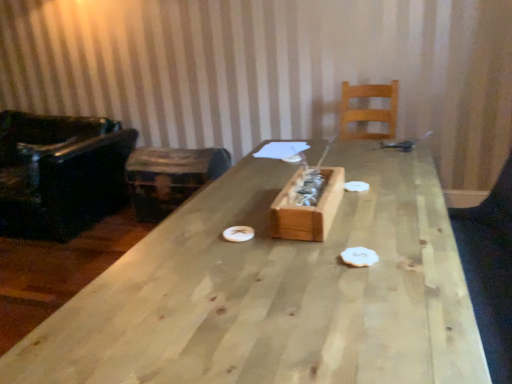
Measure the distance between white matte paper plate at center, which is counted as the 2th paper plate, starting from the top, and camera.

white matte paper plate at center, which is counted as the 2th paper plate, starting from the top, is 4.66 feet from camera.

Where is `white matte paper plate at center, which is counted as the 2th paper plate, starting from the top`? white matte paper plate at center, which is counted as the 2th paper plate, starting from the top is located at coordinates (238, 233).

In the scene shown: Could you tell me if wooden trunk at left is turned towards white matte paper plate at center, the 1th paper plate when ordered from left to right?

No, wooden trunk at left is not facing towards white matte paper plate at center, the 1th paper plate when ordered from left to right.

From the image's perspective, who appears lower, wooden trunk at left or white matte paper plate at center, the 2th paper plate when ordered from back to front?

white matte paper plate at center, the 2th paper plate when ordered from back to front, from the image's perspective.

Which is more to the right, wooden trunk at left or white matte paper plate at center, the 1th paper plate when ordered from left to right?

white matte paper plate at center, the 1th paper plate when ordered from left to right.

Which of these two, wooden trunk at left or white matte paper plate at center, marked as the second paper plate in a right-to-left arrangement, is bigger?

wooden trunk at left.

Which is correct: wooden box at center is inside wooden trunk at left, or outside of it?

The correct answer is: outside.

Does wooden box at center turn towards wooden trunk at left?

No, wooden box at center is not aimed at wooden trunk at left.

Is wooden box at center at the left side of wooden trunk at left?

In fact, wooden box at center is to the right of wooden trunk at left.

Based on the photo, from a real-world perspective, is wooden box at center positioned over wooden trunk at left based on gravity?

Correct, in the physical world, wooden box at center is higher than wooden trunk at left.

Can we say black leather chair at left, which ranks as the first chair in left-to-right order, lies outside white matte paper plate at center, marked as the second paper plate in a right-to-left arrangement?

Absolutely, black leather chair at left, which ranks as the first chair in left-to-right order, is external to white matte paper plate at center, marked as the second paper plate in a right-to-left arrangement.

Is black leather chair at left, which ranks as the first chair in left-to-right order, oriented towards white matte paper plate at center, marked as the second paper plate in a right-to-left arrangement?

No, black leather chair at left, which ranks as the first chair in left-to-right order, does not turn towards white matte paper plate at center, marked as the second paper plate in a right-to-left arrangement.

Which of these two, black leather chair at left, positioned as the second chair in right-to-left order, or white matte paper plate at center, which is counted as the 2th paper plate, starting from the top, is wider?

Wider between the two is black leather chair at left, positioned as the second chair in right-to-left order.

From a real-world perspective, is light wood chair at upper right, which is counted as the 1th chair, starting from the right, on wooden trunk at left?

Yes.

Is light wood chair at upper right, which is counted as the 1th chair, starting from the right, completely or partially outside of wooden trunk at left?

light wood chair at upper right, which is counted as the 1th chair, starting from the right, is positioned outside wooden trunk at left.

In the scene shown: Considering the relative positions of light wood chair at upper right, the second chair positioned from the left, and wooden trunk at left in the image provided, is light wood chair at upper right, the second chair positioned from the left, to the left or to the right of wooden trunk at left?

Clearly, light wood chair at upper right, the second chair positioned from the left, is on the right of wooden trunk at left in the image.

At what (x,y) coordinates should I click in order to perform the action: click on table lying on the right of wooden box at center. Please return your answer as a coordinate pair (x, y). Looking at the image, I should click on (275, 292).

Considering the relative sizes of wooden box at center and natural wood table at center in the image provided, is wooden box at center taller than natural wood table at center?

No, wooden box at center is not taller than natural wood table at center.

Can you tell me how much wooden box at center and natural wood table at center differ in facing direction?

The angle between the facing direction of wooden box at center and the facing direction of natural wood table at center is 0.219 degrees.

Is point (340, 171) positioned before point (261, 184)?

Yes, point (340, 171) is in front of point (261, 184).

What's the angular difference between wooden box at center and white matte paper plate at center, which ranks as the 1th paper plate in back-to-front order,'s facing directions?

The facing directions of wooden box at center and white matte paper plate at center, which ranks as the 1th paper plate in back-to-front order, are 0.00164 degrees apart.

Is wooden box at center completely or partially outside of white matte paper plate at center, which appears as the first paper plate when viewed from the right?

Yes, wooden box at center is located beyond the bounds of white matte paper plate at center, which appears as the first paper plate when viewed from the right.

Which of these two, wooden box at center or white matte paper plate at center, which appears as the first paper plate when viewed from the right, is wider?

wooden box at center.

Considering the relative sizes of wooden box at center and white matte paper plate at center, the 2th paper plate in the bottom-to-top sequence, in the image provided, is wooden box at center shorter than white matte paper plate at center, the 2th paper plate in the bottom-to-top sequence,?

Incorrect, the height of wooden box at center does not fall short of that of white matte paper plate at center, the 2th paper plate in the bottom-to-top sequence.

Consider the image. Is light wood chair at upper right, the second chair positioned from the left, bigger than black leather chair at left, positioned as the second chair in right-to-left order?

No, light wood chair at upper right, the second chair positioned from the left, is not bigger than black leather chair at left, positioned as the second chair in right-to-left order.

Are light wood chair at upper right, which is counted as the 1th chair, starting from the right, and black leather chair at left, which ranks as the first chair in left-to-right order, far apart?

Indeed, light wood chair at upper right, which is counted as the 1th chair, starting from the right, is not near black leather chair at left, which ranks as the first chair in left-to-right order.

Looking at this image, considering the positions of objects light wood chair at upper right, the second chair positioned from the left, and black leather chair at left, which ranks as the first chair in left-to-right order, in the image provided, who is more to the left, light wood chair at upper right, the second chair positioned from the left, or black leather chair at left, which ranks as the first chair in left-to-right order,?

black leather chair at left, which ranks as the first chair in left-to-right order.

Is light wood chair at upper right, the second chair positioned from the left, aimed at black leather chair at left, which ranks as the first chair in left-to-right order?

No, light wood chair at upper right, the second chair positioned from the left, is not aimed at black leather chair at left, which ranks as the first chair in left-to-right order.

In order to click on storage box that appears below the white matte paper plate at center, which is counted as the 2th paper plate, starting from the top (from a real-world perspective) in this screenshot , I will do `click(170, 177)`.

Where is `cardboard box that appears below the wooden trunk at left (from the image's perspective)`? The image size is (512, 384). cardboard box that appears below the wooden trunk at left (from the image's perspective) is located at coordinates (307, 208).

Looking at the image, which one is located closer to wooden box at center, black leather chair at left, positioned as the second chair in right-to-left order, or light wood chair at upper right, the second chair positioned from the left?

Among the two, light wood chair at upper right, the second chair positioned from the left, is located nearer to wooden box at center.

From the image, which object appears to be farther from white matte paper plate at center, the 2th paper plate viewed from the front, natural wood table at center or wooden trunk at left?

wooden trunk at left is positioned further to the anchor white matte paper plate at center, the 2th paper plate viewed from the front.

When comparing their distances from wooden trunk at left, does black leather chair at left, which ranks as the first chair in left-to-right order, or natural wood table at center seem closer?

black leather chair at left, which ranks as the first chair in left-to-right order.

Considering their positions, is wooden trunk at left positioned further to black leather chair at left, positioned as the second chair in right-to-left order, than natural wood table at center?

natural wood table at center.

Considering their positions, is white matte paper plate at center, the 2th paper plate viewed from the front, positioned further to wooden box at center than light wood chair at upper right, the second chair positioned from the left?

light wood chair at upper right, the second chair positioned from the left, is further to wooden box at center.

Based on their spatial positions, is wooden trunk at left or natural wood table at center further from light wood chair at upper right, which is counted as the 1th chair, starting from the right?

Among the two, natural wood table at center is located further to light wood chair at upper right, which is counted as the 1th chair, starting from the right.

Based on their spatial positions, is wooden box at center or white matte paper plate at center, acting as the second paper plate starting from the left, further from natural wood table at center?

white matte paper plate at center, acting as the second paper plate starting from the left, is further to natural wood table at center.

Estimate the real-world distances between objects in this image. Which object is closer to natural wood table at center, wooden trunk at left or white matte paper plate at center, the 2th paper plate in the bottom-to-top sequence?

The object closer to natural wood table at center is white matte paper plate at center, the 2th paper plate in the bottom-to-top sequence.

This screenshot has height=384, width=512. In order to click on storage box between black leather chair at left, which ranks as the first chair in left-to-right order, and light wood chair at upper right, the second chair positioned from the left, from left to right in this screenshot , I will do `click(170, 177)`.

Where is `storage box situated between black leather chair at left, positioned as the second chair in right-to-left order, and wooden box at center from left to right`? storage box situated between black leather chair at left, positioned as the second chair in right-to-left order, and wooden box at center from left to right is located at coordinates (170, 177).

At what (x,y) coordinates should I click in order to perform the action: click on cardboard box between black leather chair at left, which ranks as the first chair in left-to-right order, and natural wood table at center. Please return your answer as a coordinate pair (x, y). Looking at the image, I should click on (307, 208).

Where is `storage box between black leather chair at left, positioned as the second chair in right-to-left order, and white matte paper plate at center, the 1th paper plate when ordered from left to right, in the horizontal direction`? storage box between black leather chair at left, positioned as the second chair in right-to-left order, and white matte paper plate at center, the 1th paper plate when ordered from left to right, in the horizontal direction is located at coordinates (170, 177).